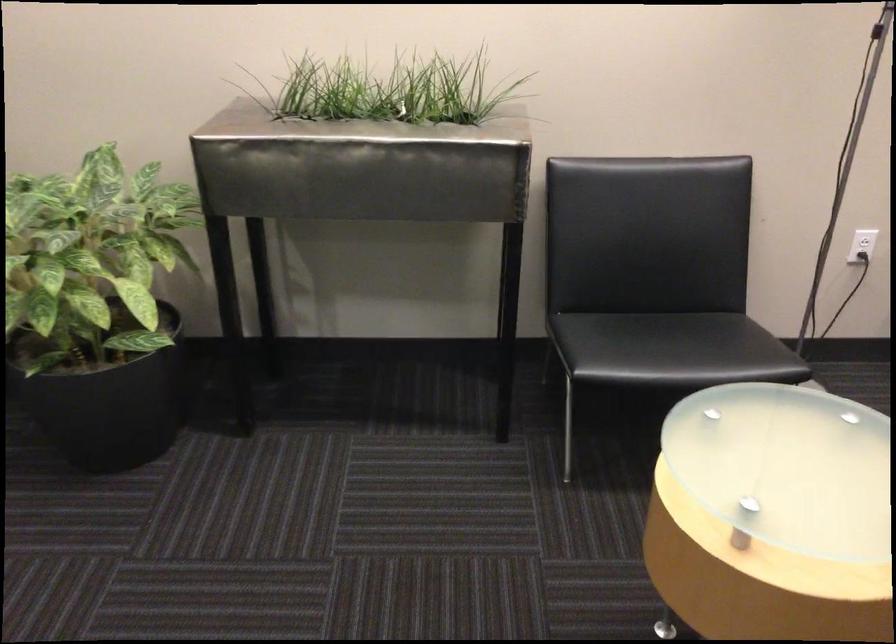
The image size is (896, 644). What do you see at coordinates (866, 239) in the screenshot?
I see `the white power outlet` at bounding box center [866, 239].